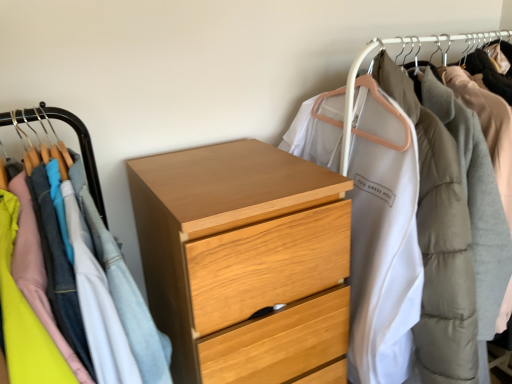
Question: Relative to wooden chest of drawers at center, which is the first closet from left to right, is light wood chest of drawers at center in front or behind?

Choices:
 (A) front
 (B) behind

Answer: (B)

Question: From their relative heights in the image, would you say light wood chest of drawers at center is taller or shorter than wooden chest of drawers at center, which ranks as the second closet in right-to-left order?

Choices:
 (A) tall
 (B) short

Answer: (A)

Question: Based on their relative distances, which object is nearer to the wooden chest of drawers at center, which ranks as the second closet in right-to-left order?

Choices:
 (A) light wood chest of drawers at center
 (B) white matte coat at upper right, which is the 1th closet in right-to-left order

Answer: (A)

Question: Estimate the real-world distances between objects in this image. Which object is farther from the white matte coat at upper right, the 2th closet viewed from the left?

Choices:
 (A) wooden chest of drawers at center, which ranks as the second closet in right-to-left order
 (B) light wood chest of drawers at center

Answer: (A)